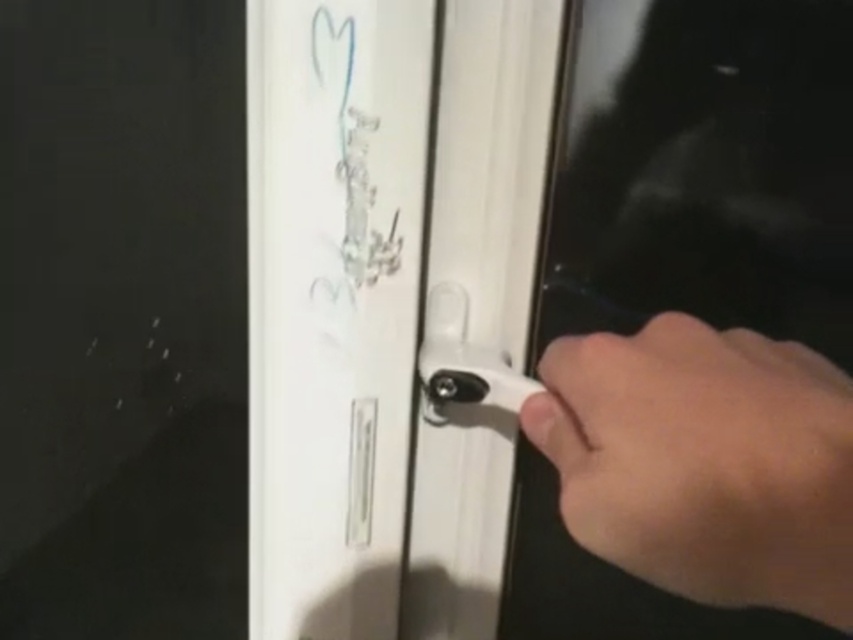
You are trying to determine which point is closer to you in the image. Which of the two points, point (387, 13) or point (428, 348), is closer to you?

Point (387, 13) is closer to the viewer than point (428, 348).

From the picture: You are trying to open the door by gripping the white glossy door handle at center with your skinny white hand at right. Can your hand fit around the handle comfortably?

The white glossy door handle at center is narrower than the skinny white hand at right, so your hand can fit around it comfortably.

You are a delivery person holding a large package that is 20 inches long. You need to place it on a surface near the white glossy door handle at center. Is there enough space between you and the handle to place the package without moving your current position?

The white glossy door handle at center is 18.66 inches away from the viewer. Since the package is 20 inches long, it is longer than the available space, so you cannot place the package without moving.